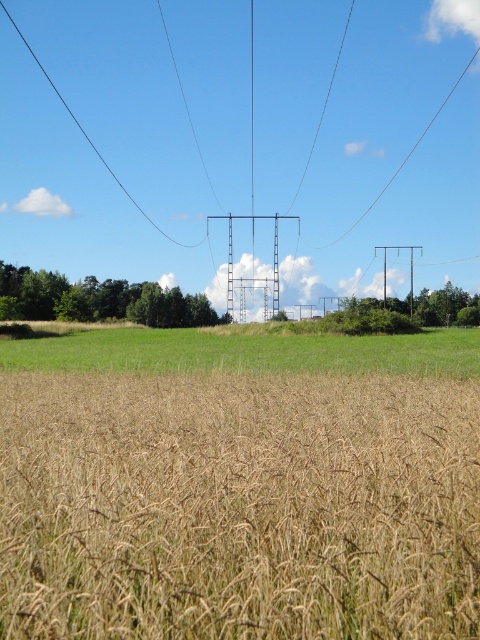
You are standing in the middle of the golden crops and see the green leafy tree at lower left and the green leafy tree at right. Which tree is higher up in the image?

The green leafy tree at lower left is higher up than the green leafy tree at right.

You are a farmer inspecting your fields. You notice the green grass at center and the green leafy tree at right. Which one do you think is smaller in size?

The green grass at center is smaller in size compared to the green leafy tree at right according to the description.